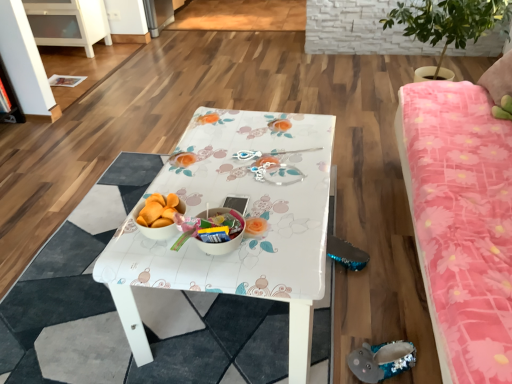
The height and width of the screenshot is (384, 512). I want to click on vacant space positioned to the left of sequined gray slipper at lower right, so point(324,357).